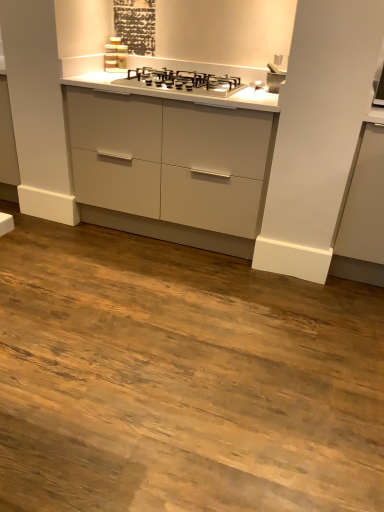
Question: Should I look upward or downward to see satin silver gas stove at center?

Choices:
 (A) down
 (B) up

Answer: (B)

Question: Can you confirm if satin silver gas stove at center is wider than matte gray cabinet at right?

Choices:
 (A) yes
 (B) no

Answer: (B)

Question: Is satin silver gas stove at center shorter than matte gray cabinet at right?

Choices:
 (A) yes
 (B) no

Answer: (A)

Question: From a real-world perspective, is satin silver gas stove at center below matte gray cabinet at right?

Choices:
 (A) yes
 (B) no

Answer: (B)

Question: Does satin silver gas stove at center contain matte gray cabinet at right?

Choices:
 (A) yes
 (B) no

Answer: (B)

Question: Is satin silver gas stove at center taller than matte gray cabinet at right?

Choices:
 (A) yes
 (B) no

Answer: (B)

Question: Is satin silver gas stove at center turned away from matte gray cabinet at right?

Choices:
 (A) no
 (B) yes

Answer: (A)

Question: From a real-world perspective, is satin silver faucet at upper right positioned under satin silver gas stove at center based on gravity?

Choices:
 (A) yes
 (B) no

Answer: (B)

Question: Is satin silver faucet at upper right taller than satin silver gas stove at center?

Choices:
 (A) no
 (B) yes

Answer: (B)

Question: Can you confirm if satin silver faucet at upper right is shorter than satin silver gas stove at center?

Choices:
 (A) yes
 (B) no

Answer: (B)

Question: Is satin silver faucet at upper right facing towards satin silver gas stove at center?

Choices:
 (A) no
 (B) yes

Answer: (A)

Question: Would you say satin silver faucet at upper right is outside satin silver gas stove at center?

Choices:
 (A) yes
 (B) no

Answer: (A)

Question: Is satin silver faucet at upper right wider than satin silver gas stove at center?

Choices:
 (A) no
 (B) yes

Answer: (A)

Question: From a real-world perspective, is matte gray cabinet at right below satin silver gas stove at center?

Choices:
 (A) no
 (B) yes

Answer: (B)